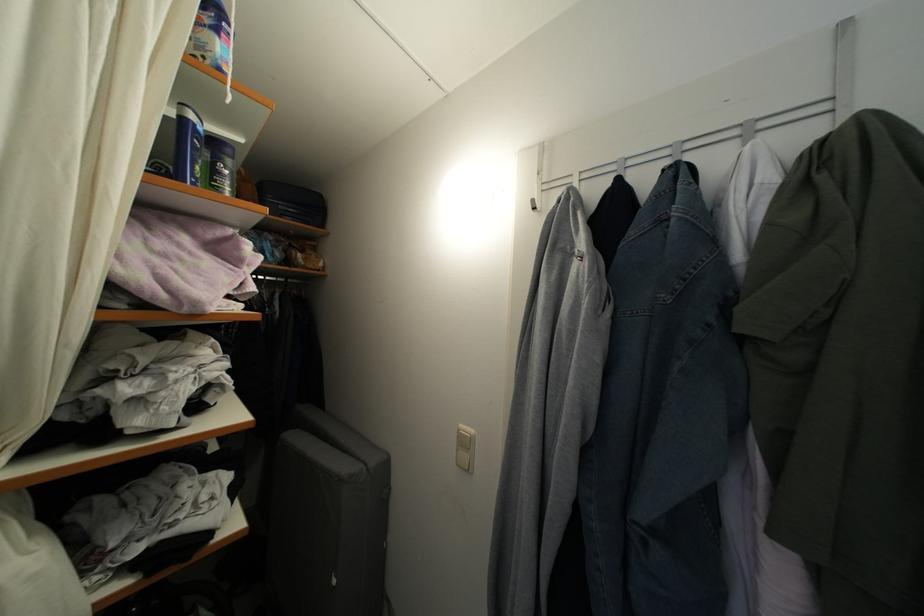
Locate an element on the screen. The image size is (924, 616). gray folded cushion is located at coordinates (326, 519).